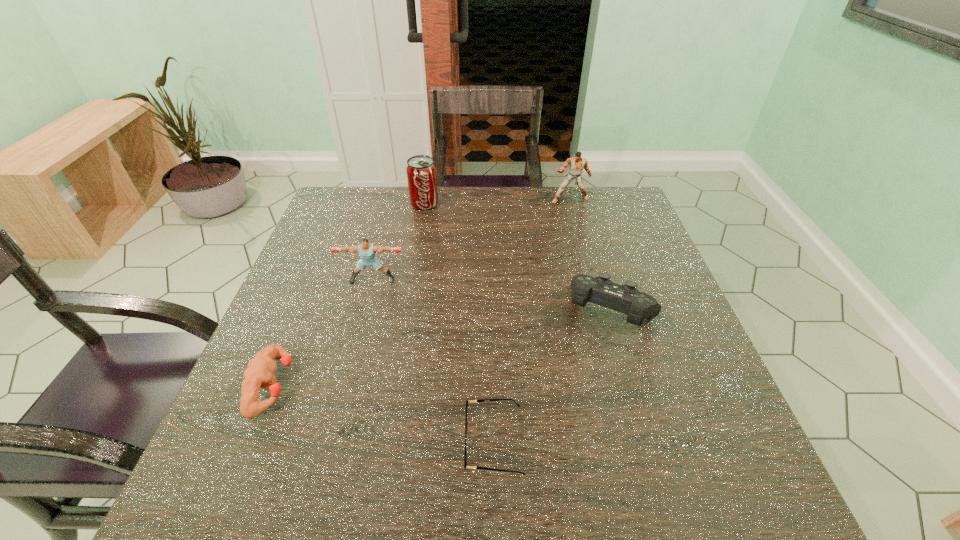
This screenshot has height=540, width=960. Identify the location of free space between the spectacles and the pop soda. (459, 323).

The image size is (960, 540). Find the location of `free area in between the shortest object and the tallest puncher`. free area in between the shortest object and the tallest puncher is located at coordinates (532, 321).

This screenshot has height=540, width=960. In order to click on object that ranks as the fifth closest to the nearest puncher in this screenshot , I will do `click(577, 164)`.

Identify which object is the closest to the third shortest object. Please provide its 2D coordinates. Your answer should be formatted as a tuple, i.e. [(x, y)], where the tuple contains the x and y coordinates of a point satisfying the conditions above.

[(465, 463)]

Identify which puncher is the nearest to the fourth object from left to right. Please provide its 2D coordinates. Your answer should be formatted as a tuple, i.e. [(x, y)], where the tuple contains the x and y coordinates of a point satisfying the conditions above.

[(260, 370)]

Locate which puncher is the closest to the leftmost puncher. Please provide its 2D coordinates. Your answer should be formatted as a tuple, i.e. [(x, y)], where the tuple contains the x and y coordinates of a point satisfying the conditions above.

[(366, 250)]

Locate an element on the screen. The width and height of the screenshot is (960, 540). vacant region that satisfies the following two spatial constraints: 1. on the front-facing side of the tallest puncher; 2. with the gloves of the second shortest object facing forward is located at coordinates (622, 385).

Image resolution: width=960 pixels, height=540 pixels. Find the location of `free space in the image that satisfies the following two spatial constraints: 1. on the front-facing side of the rightmost puncher; 2. on the front-facing side of the fourth object from left to right`. free space in the image that satisfies the following two spatial constraints: 1. on the front-facing side of the rightmost puncher; 2. on the front-facing side of the fourth object from left to right is located at coordinates (638, 443).

The height and width of the screenshot is (540, 960). Identify the location of vacant space that satisfies the following two spatial constraints: 1. on the front-facing side of the second puncher from left to right; 2. with the gloves of the leftmost object facing forward. (345, 385).

Locate an element on the screen. This screenshot has width=960, height=540. free space that satisfies the following two spatial constraints: 1. on the front-facing side of the third shortest object; 2. on the left side of the farthest puncher is located at coordinates (602, 312).